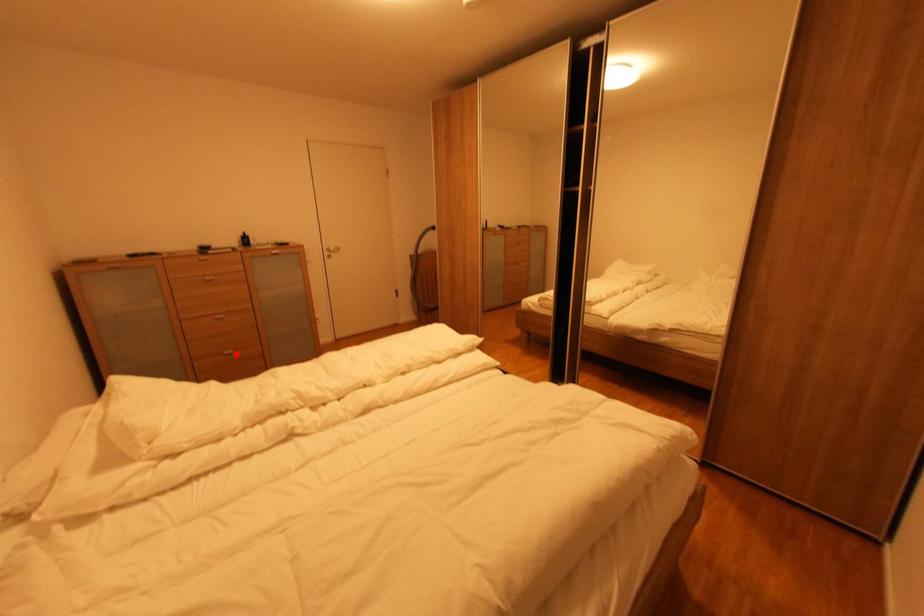
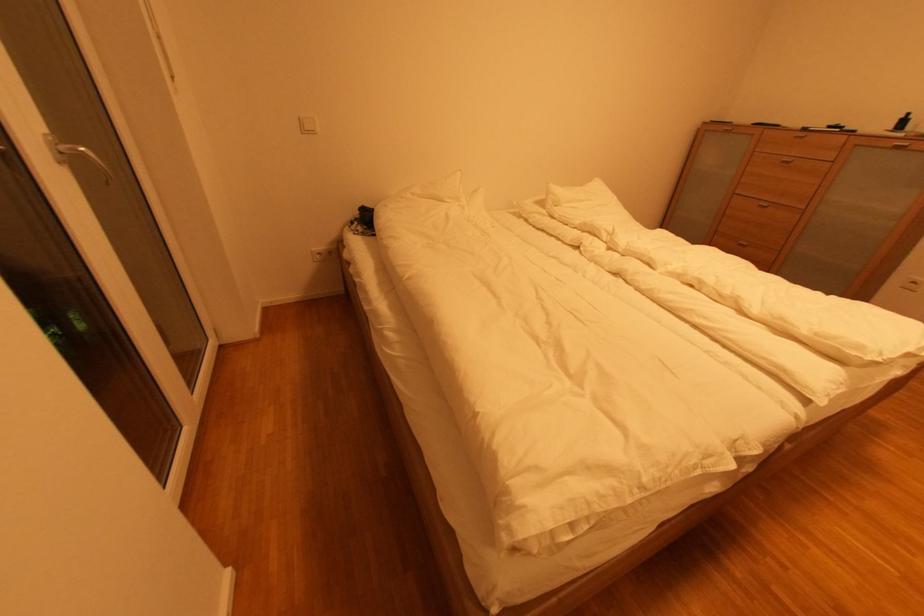
The point at the highlighted location is marked in the first image. Where is the corresponding point in the second image?

(749, 246)